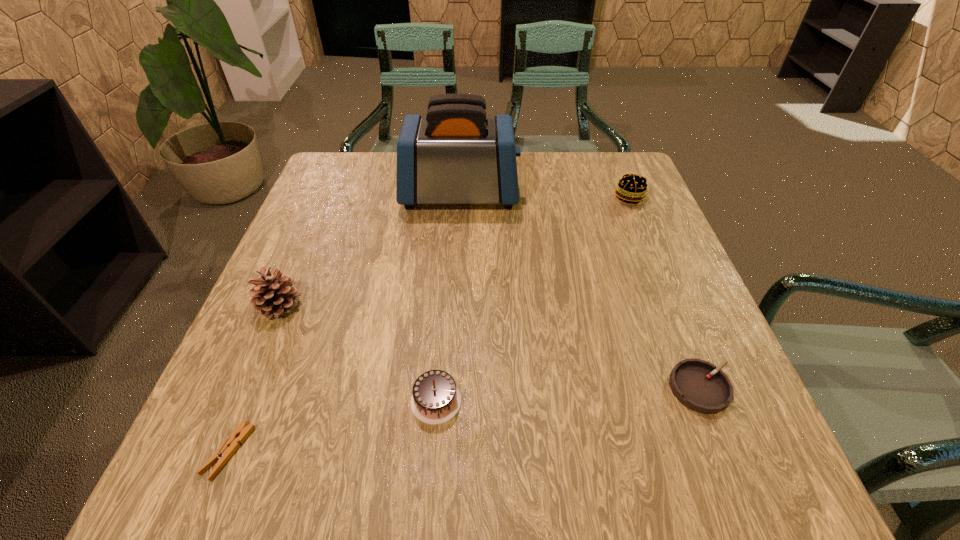
Locate an element on the screen. This screenshot has height=540, width=960. vacant space that satisfies the following two spatial constraints: 1. on the front-facing side of the patty; 2. on the left side of the toaster is located at coordinates (460, 198).

Image resolution: width=960 pixels, height=540 pixels. What are the coordinates of `vacant space that satisfies the following two spatial constraints: 1. on the back side of the second shortest object; 2. on the left side of the patty` in the screenshot? It's located at (625, 198).

Find the location of a particular element. blank area in the image that satisfies the following two spatial constraints: 1. on the front-facing side of the toaster; 2. on the back side of the second shortest object is located at coordinates (449, 388).

The width and height of the screenshot is (960, 540). I want to click on free space that satisfies the following two spatial constraints: 1. on the back side of the ashtray; 2. on the front-facing side of the toaster, so click(x=623, y=194).

You are a GUI agent. You are given a task and a screenshot of the screen. Output one action in this format:
    pyautogui.click(x=<x>, y=<y>)
    Task: Click on the free space that satisfies the following two spatial constraints: 1. on the back side of the fourth nearest object; 2. on the left side of the patty
    This screenshot has width=960, height=540.
    Given the screenshot: What is the action you would take?
    pyautogui.click(x=325, y=198)

Identify the location of blank space that satisfies the following two spatial constraints: 1. on the front-facing side of the ashtray; 2. on the right side of the tallest object. (449, 388).